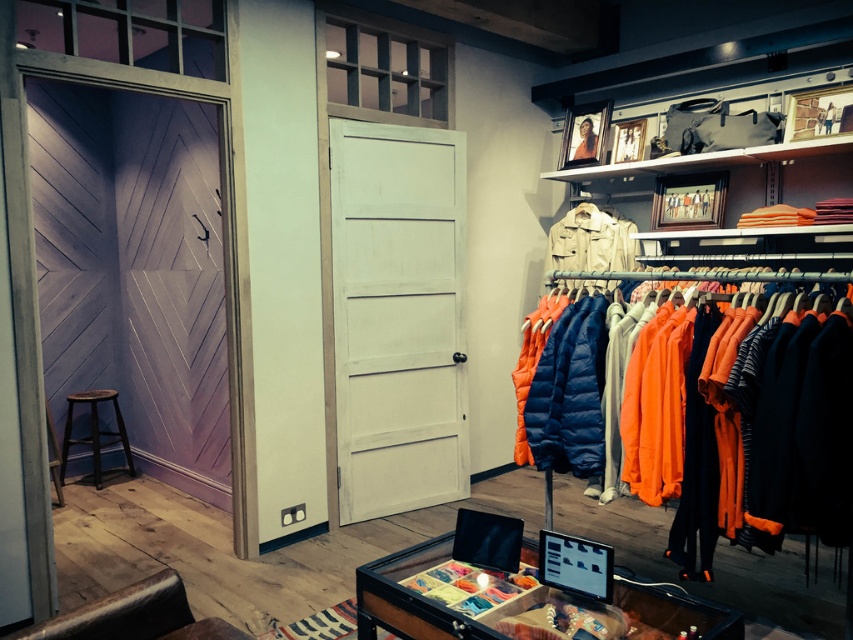
Who is higher up, orange quilted jacket at right or khaki canvas jacket at center?

khaki canvas jacket at center is above.

Based on the photo, how distant is orange quilted jacket at right from khaki canvas jacket at center?

A distance of 6.96 feet exists between orange quilted jacket at right and khaki canvas jacket at center.

Which is behind, point (570, 458) or point (625, 240)?

Positioned behind is point (625, 240).

Find the location of a particular element. orange quilted jacket at right is located at coordinates (755, 413).

Does khaki canvas jacket at center appear on the right side of black wood stool at lower left?

Correct, you'll find khaki canvas jacket at center to the right of black wood stool at lower left.

Which is below, khaki canvas jacket at center or black wood stool at lower left?

black wood stool at lower left

Who is more distant from viewer, (569, 236) or (73, 394)?

Positioned behind is point (73, 394).

Where is `khaki canvas jacket at center`? khaki canvas jacket at center is located at coordinates (590, 241).

Looking at this image, does orange quilted jacket at right have a greater height compared to black wood stool at lower left?

Yes.

Is orange quilted jacket at right positioned in front of black wood stool at lower left?

Yes, it is.

Between point (772, 468) and point (115, 396), which one is positioned in front?

Positioned in front is point (772, 468).

Locate an element on the screen. The width and height of the screenshot is (853, 640). orange quilted jacket at right is located at coordinates (755, 413).